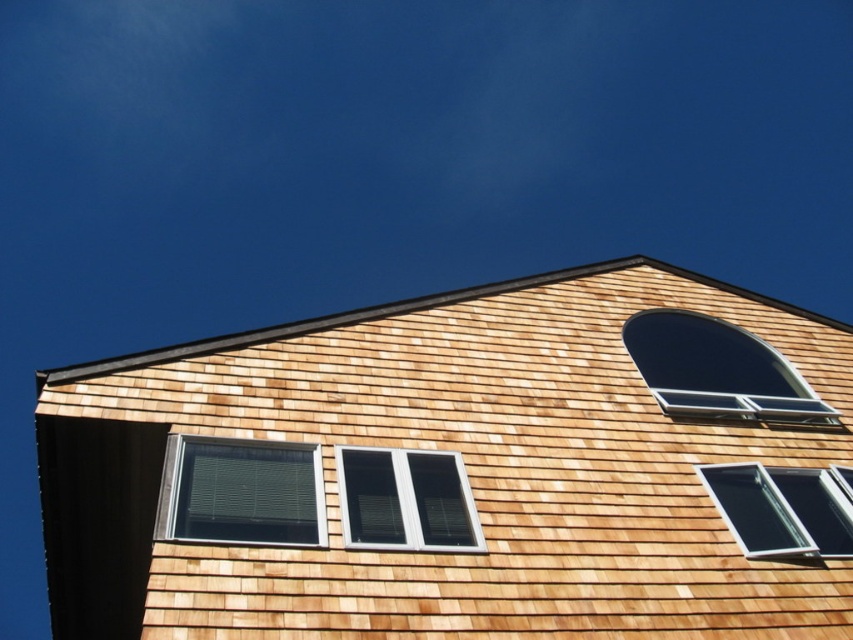
Question: Considering the real-world distances, which object is farthest from the clear glass window at lower right?

Choices:
 (A) matte glass window at lower left
 (B) natural wood siding at center

Answer: (A)

Question: Which object appears closest to the camera in this image?

Choices:
 (A) natural wood siding at center
 (B) clear glass window at lower right
 (C) dark glass window at upper right

Answer: (A)

Question: Among these objects, which one is nearest to the camera?

Choices:
 (A) clear glass window at lower right
 (B) matte glass window at lower left

Answer: (B)

Question: Does natural wood siding at center have a greater width compared to clear glass window at lower right?

Choices:
 (A) yes
 (B) no

Answer: (A)

Question: Does white plastic window at center have a smaller size compared to clear glass window at lower right?

Choices:
 (A) yes
 (B) no

Answer: (A)

Question: Is matte glass window at lower left above white plastic window at center?

Choices:
 (A) yes
 (B) no

Answer: (A)